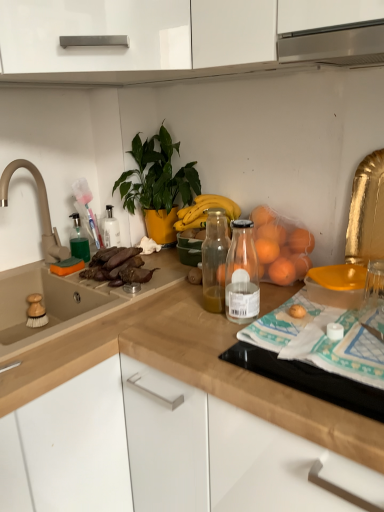
At what (x,y) coordinates should I click in order to perform the action: click on vacant region to the left of green translucent soap dispenser at left. Please return your answer as a coordinate pair (x, y). Looking at the image, I should click on (46, 266).